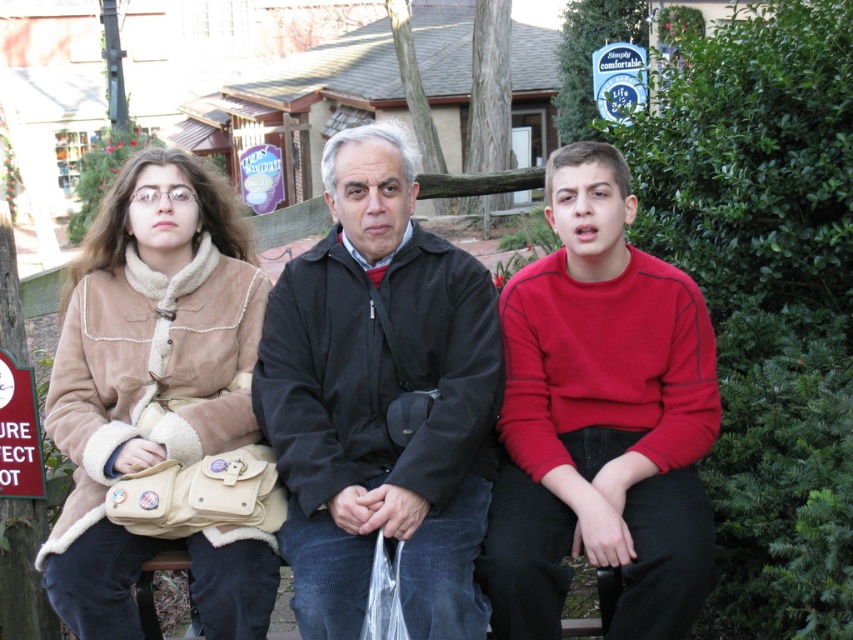
Consider the image. Between black matte jacket at center and suede jacket at left, which one is positioned higher?

black matte jacket at center is higher up.

Who is lower down, black matte jacket at center or suede jacket at left?

suede jacket at left is lower down.

Does point (337, 170) come in front of point (137, 353)?

That is True.

Locate an element on the screen. The image size is (853, 640). black matte jacket at center is located at coordinates (381, 401).

Between beige suede jacket at left and black matte jacket at center, which one is positioned higher?

black matte jacket at center

Is point (314, 419) less distant than point (357, 416)?

Yes, it is.

Identify the location of beige suede jacket at left. (456, 426).

At what (x,y) coordinates should I click in order to perform the action: click on black matte jacket at center. Please return your answer as a coordinate pair (x, y). The width and height of the screenshot is (853, 640). Looking at the image, I should click on (381, 401).

Does black matte jacket at center have a greater width compared to red matte sweater at center?

Indeed, black matte jacket at center has a greater width compared to red matte sweater at center.

Between point (402, 177) and point (560, 524), which one is positioned in front?

Positioned in front is point (560, 524).

This screenshot has width=853, height=640. Find the location of `black matte jacket at center`. black matte jacket at center is located at coordinates (381, 401).